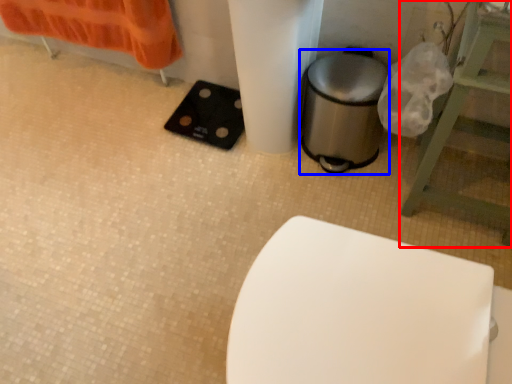
Question: Which point is closer to the camera, furniture (highlighted by a red box) or appliance (highlighted by a blue box)?

Choices:
 (A) furniture
 (B) appliance

Answer: (A)